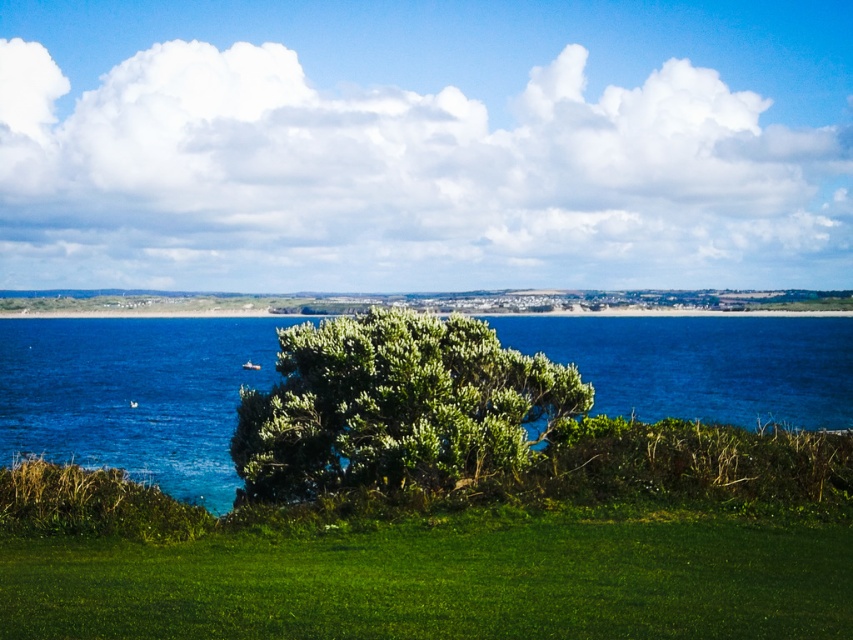
Question: Is green grassy at lower center further to the viewer compared to green leafy bush at center?

Choices:
 (A) yes
 (B) no

Answer: (B)

Question: Which of these objects is positioned farthest from the blue water at center?

Choices:
 (A) green grassy at lower center
 (B) green leafy bush at center

Answer: (A)

Question: Which point appears closest to the camera in this image?

Choices:
 (A) (537, 545)
 (B) (782, 419)
 (C) (553, 403)

Answer: (A)

Question: Can you confirm if blue water at center is positioned to the right of green leafy bush at center?

Choices:
 (A) no
 (B) yes

Answer: (B)

Question: Is green grassy at lower center bigger than green leafy bush at center?

Choices:
 (A) yes
 (B) no

Answer: (B)

Question: Which object is the closest to the green grassy at lower center?

Choices:
 (A) green leafy bush at center
 (B) blue water at center

Answer: (A)